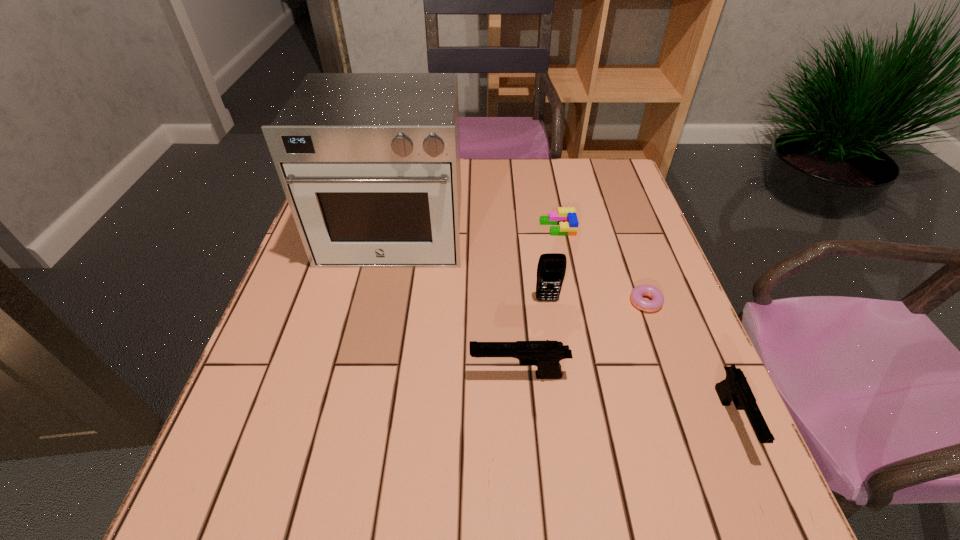
Locate an element on the screen. The width and height of the screenshot is (960, 540). free space between the second tallest object and the doughnut is located at coordinates (596, 302).

Locate an element on the screen. This screenshot has height=540, width=960. vacant space that is in between the leftmost object and the cellular telephone is located at coordinates (470, 266).

I want to click on vacant space that is in between the rightmost object and the Lego, so click(645, 323).

This screenshot has width=960, height=540. Find the location of `vacant space that is in between the tallest object and the second nearest object`. vacant space that is in between the tallest object and the second nearest object is located at coordinates (456, 303).

This screenshot has width=960, height=540. I want to click on free space that is in between the doughnut and the Lego, so click(602, 266).

Identify the location of free space between the farther pistol and the second tallest object. (533, 338).

The width and height of the screenshot is (960, 540). Find the location of `vacant space in between the shortest object and the toaster oven`. vacant space in between the shortest object and the toaster oven is located at coordinates (520, 268).

Locate an element on the screen. The width and height of the screenshot is (960, 540). free space between the fifth shortest object and the fifth object from left to right is located at coordinates (596, 302).

You are a GUI agent. You are given a task and a screenshot of the screen. Output one action in this format:
    pyautogui.click(x=<x>, y=<y>)
    Task: Click on the object that can be found as the fourth closest to the left pistol
    Image resolution: width=960 pixels, height=540 pixels.
    Given the screenshot: What is the action you would take?
    pyautogui.click(x=734, y=387)

Where is `object that ranks as the fifth closest to the fifth shortest object`? This screenshot has height=540, width=960. object that ranks as the fifth closest to the fifth shortest object is located at coordinates (734, 387).